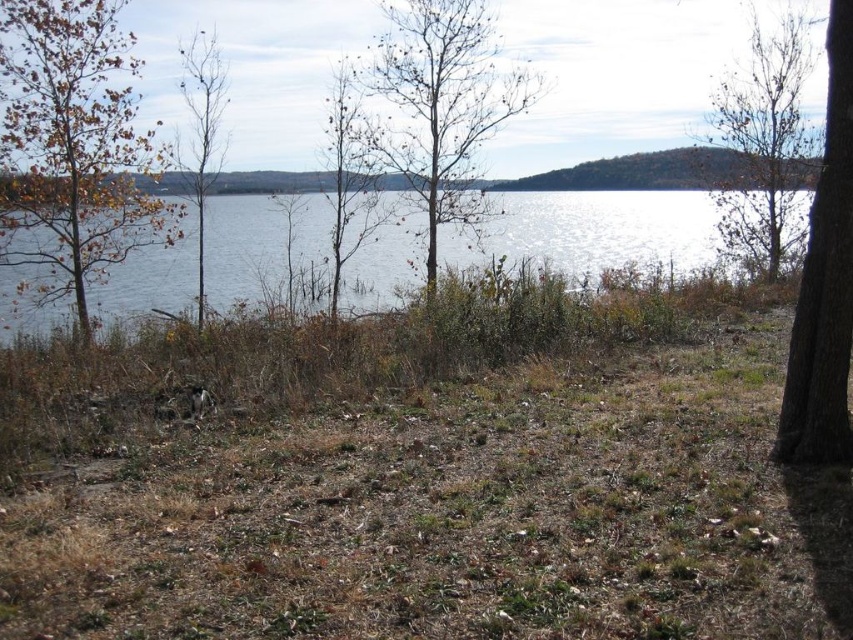
Question: Which point appears farthest from the camera in this image?

Choices:
 (A) (175, 518)
 (B) (610, 266)

Answer: (B)

Question: Does clear water at upper center have a lesser width compared to yellowish-brown bark tree at left?

Choices:
 (A) yes
 (B) no

Answer: (B)

Question: From the image, what is the correct spatial relationship of brown leafy tree at upper right in relation to brown rough bark tree at right?

Choices:
 (A) right
 (B) left

Answer: (A)

Question: Which point is farther to the camera?

Choices:
 (A) (370, 188)
 (B) (74, 230)
 (C) (795, 424)

Answer: (A)

Question: Which point is closer to the camera?

Choices:
 (A) brown dry grass at center
 (B) bare wood tree at center
 (C) brown rough bark tree at right

Answer: (A)

Question: Does bare branches at center appear over brown rough bark tree at right?

Choices:
 (A) no
 (B) yes

Answer: (B)